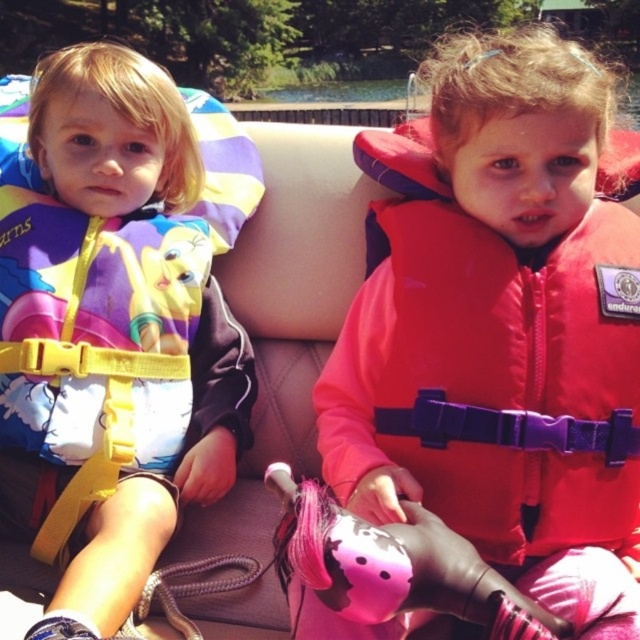
The height and width of the screenshot is (640, 640). What do you see at coordinates (109, 333) in the screenshot?
I see `matte yellow life vest at left` at bounding box center [109, 333].

Between point (131, 250) and point (436, 438), which one is positioned in front?

Positioned in front is point (436, 438).

Does point (99, 620) lie in front of point (348, 323)?

That is True.

Where is `matte yellow life vest at left`? matte yellow life vest at left is located at coordinates (109, 333).